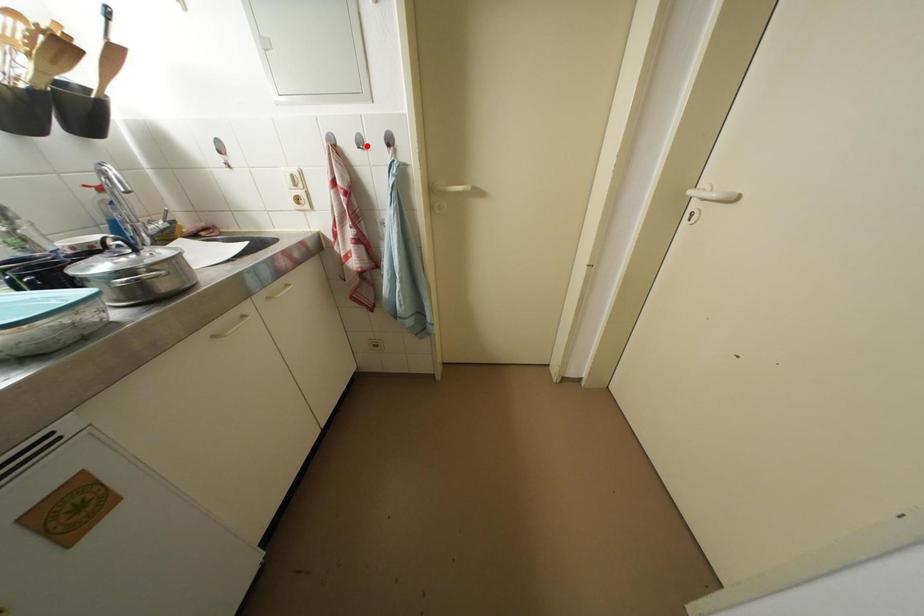
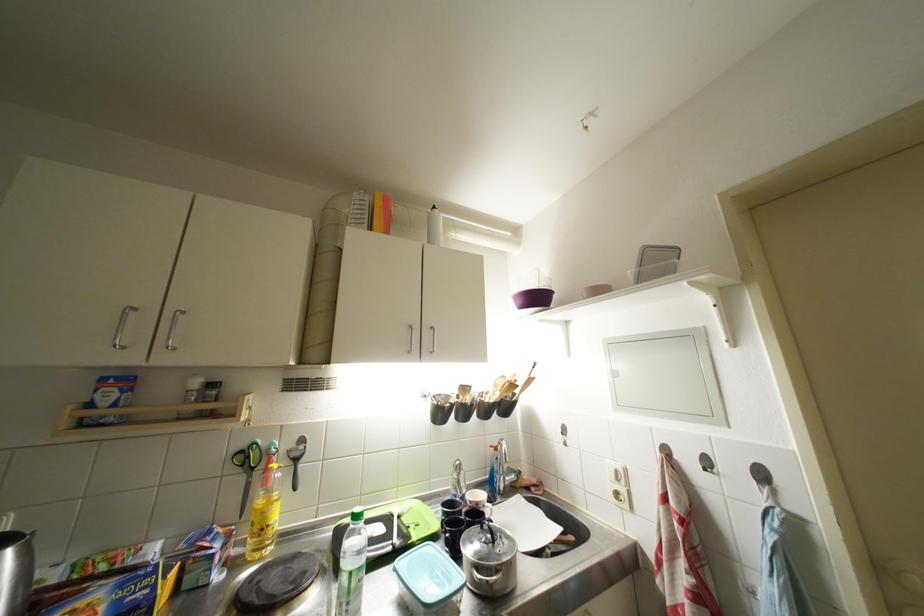
Question: I am providing you with two images of the same scene from different viewpoints. In image1, a red point is highlighted. Considering the same 3D point in image2, which of the following is correct?

Choices:
 (A) It is closer
 (B) It is farther

Answer: (B)